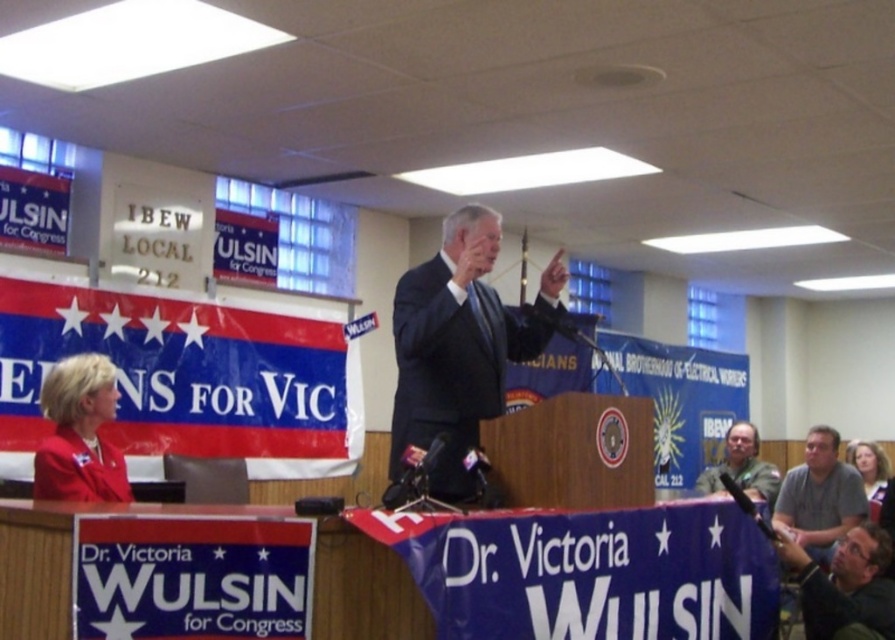
Question: In this image, where is matte red blouse at lower left located relative to green fabric shirt at lower right?

Choices:
 (A) left
 (B) right

Answer: (A)

Question: Is dark suit at center thinner than dark gray shirt at lower right?

Choices:
 (A) yes
 (B) no

Answer: (B)

Question: Is matte red blouse at lower left to the left of green fabric shirt at lower right from the viewer's perspective?

Choices:
 (A) no
 (B) yes

Answer: (B)

Question: Which point is closer to the camera?

Choices:
 (A) (410, 296)
 (B) (846, 609)
 (C) (770, 476)
 (D) (808, 467)

Answer: (A)

Question: Which object appears closest to the camera in this image?

Choices:
 (A) gray casual shirt at lower right
 (B) dark suit at center

Answer: (B)

Question: Which point is closer to the camera?

Choices:
 (A) matte red blouse at lower left
 (B) dark gray shirt at lower right
 (C) green fabric shirt at lower right
 (D) gray casual shirt at lower right

Answer: (A)